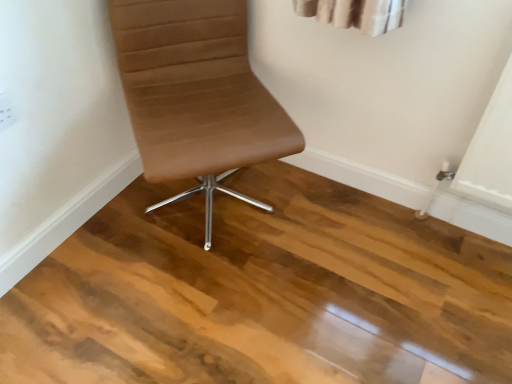
The width and height of the screenshot is (512, 384). What are the coordinates of `space that is in front of brown leather chair at center` in the screenshot? It's located at (196, 310).